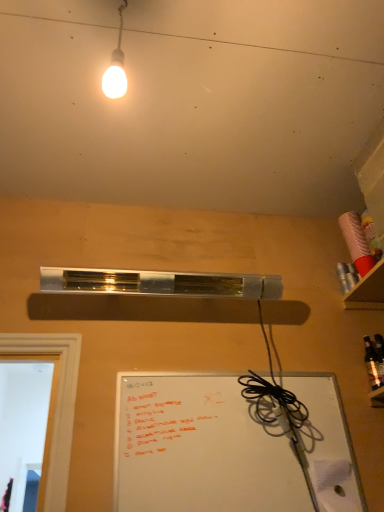
Question: Is cardboard shelf at upper right wider or thinner than shiny dark glass bottle at right?

Choices:
 (A) wide
 (B) thin

Answer: (A)

Question: Do you think cardboard shelf at upper right is within shiny dark glass bottle at right, or outside of it?

Choices:
 (A) outside
 (B) inside

Answer: (A)

Question: Which of these objects is positioned farthest from the cardboard shelf at upper right?

Choices:
 (A) whiteboard at lower right
 (B) matte white bulb at upper center
 (C) shiny dark glass bottle at right

Answer: (B)

Question: Which object is the farthest from the shiny dark glass bottle at right?

Choices:
 (A) cardboard shelf at upper right
 (B) whiteboard at lower right
 (C) matte white bulb at upper center

Answer: (C)